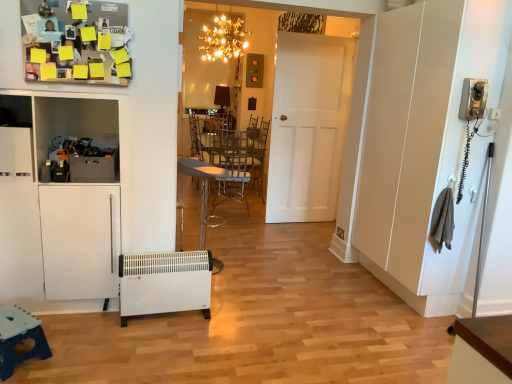
Question: Is white plastic heater at lower left far from white matte door at center?

Choices:
 (A) no
 (B) yes

Answer: (B)

Question: Can you confirm if white plastic heater at lower left is thinner than white matte door at center?

Choices:
 (A) no
 (B) yes

Answer: (A)

Question: Can you confirm if white plastic heater at lower left is positioned to the left of white matte door at center?

Choices:
 (A) no
 (B) yes

Answer: (B)

Question: Considering the relative sizes of white plastic heater at lower left and white matte door at center in the image provided, is white plastic heater at lower left shorter than white matte door at center?

Choices:
 (A) no
 (B) yes

Answer: (B)

Question: Is white matte door at center inside white plastic heater at lower left?

Choices:
 (A) yes
 (B) no

Answer: (B)

Question: In the image, is metallic silver table at center, placed as the 1th table when sorted from right to left, on the left side or the right side of white matte door at center?

Choices:
 (A) left
 (B) right

Answer: (A)

Question: From their relative heights in the image, would you say metallic silver table at center, placed as the 1th table when sorted from right to left, is taller or shorter than white matte door at center?

Choices:
 (A) tall
 (B) short

Answer: (B)

Question: From a real-world perspective, relative to white matte door at center, is metallic silver table at center, which ranks as the second table in front-to-back order, vertically above or below?

Choices:
 (A) above
 (B) below

Answer: (B)

Question: Looking at the image, does metallic silver table at center, acting as the 1th table starting from the back, seem bigger or smaller compared to white matte door at center?

Choices:
 (A) big
 (B) small

Answer: (B)

Question: From the image's perspective, is metallic silver chair at center above or below blue plastic table at lower left, which is the 2th table from back to front?

Choices:
 (A) below
 (B) above

Answer: (B)

Question: Is point (202, 168) positioned closer to the camera than point (10, 347)?

Choices:
 (A) farther
 (B) closer

Answer: (A)

Question: Is metallic silver chair at center inside or outside of blue plastic table at lower left, which is the 2th table from top to bottom?

Choices:
 (A) inside
 (B) outside

Answer: (B)

Question: In terms of height, does metallic silver chair at center look taller or shorter compared to blue plastic table at lower left, which is the 2th table from back to front?

Choices:
 (A) short
 (B) tall

Answer: (B)

Question: Visually, is gold metallic chandelier at upper center positioned to the left or to the right of blue plastic table at lower left, acting as the 1th table starting from the bottom?

Choices:
 (A) right
 (B) left

Answer: (A)

Question: Choose the correct answer: Is gold metallic chandelier at upper center inside blue plastic table at lower left, acting as the 1th table starting from the bottom, or outside it?

Choices:
 (A) inside
 (B) outside

Answer: (B)